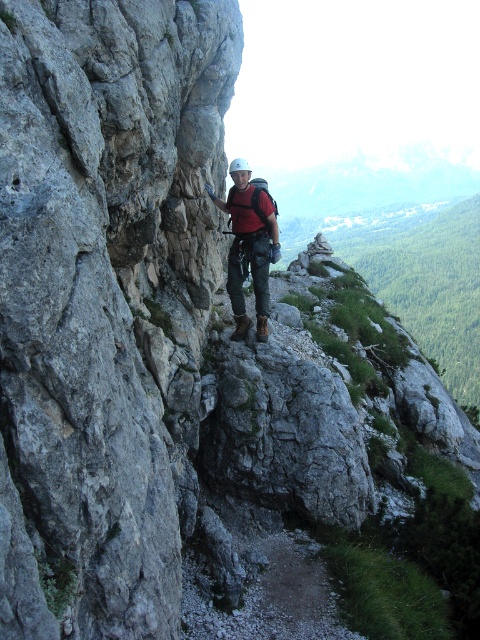
Question: Is gray rough rock face at center above matte red shirt at center?

Choices:
 (A) no
 (B) yes

Answer: (A)

Question: Among these objects, which one is nearest to the camera?

Choices:
 (A) gray rough rock face at center
 (B) matte red shirt at center

Answer: (A)

Question: Can you confirm if gray rough rock face at center is bigger than matte red shirt at center?

Choices:
 (A) yes
 (B) no

Answer: (A)

Question: Does gray rough rock face at center have a larger size compared to matte red shirt at center?

Choices:
 (A) no
 (B) yes

Answer: (B)

Question: Which point is farther to the camera?

Choices:
 (A) matte red shirt at center
 (B) gray rough rock face at center

Answer: (A)